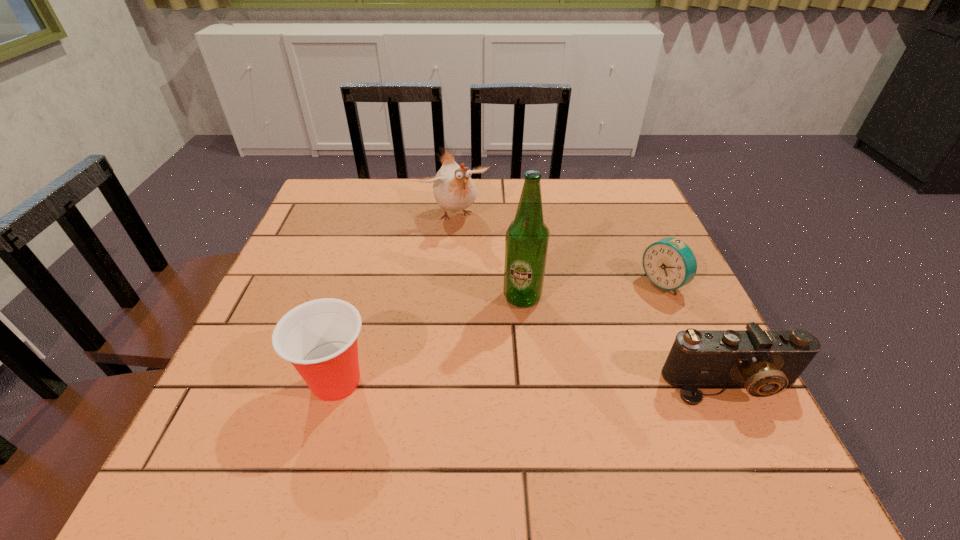
I want to click on camera situated at the near edge, so click(x=764, y=361).

The height and width of the screenshot is (540, 960). Find the location of `object that is positioned at the left edge`. object that is positioned at the left edge is located at coordinates (319, 337).

The width and height of the screenshot is (960, 540). I want to click on camera that is at the right edge, so click(764, 361).

Where is `alarm clock present at the right edge`? alarm clock present at the right edge is located at coordinates (669, 263).

In order to click on object that is at the near left corner in this screenshot , I will do `click(319, 337)`.

This screenshot has height=540, width=960. I want to click on object that is positioned at the near right corner, so click(764, 361).

Locate an element on the screen. The width and height of the screenshot is (960, 540). vacant space at the far edge of the desktop is located at coordinates (549, 210).

In the image, there is a desktop. Where is `vacant space at the near edge`? Image resolution: width=960 pixels, height=540 pixels. vacant space at the near edge is located at coordinates (578, 411).

Where is `free location at the left edge`? Image resolution: width=960 pixels, height=540 pixels. free location at the left edge is located at coordinates (284, 281).

I want to click on vacant space at the right edge, so click(639, 307).